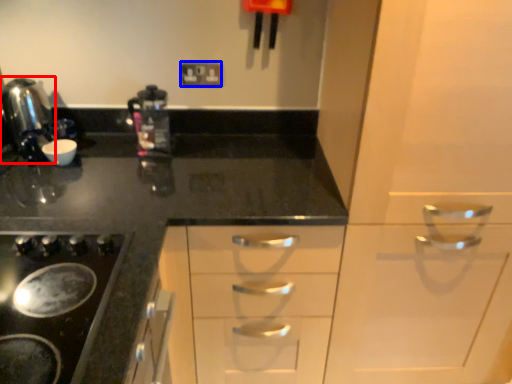
Question: Which object appears closest to the camera in this image, kitchen appliance (highlighted by a red box) or electric outlet (highlighted by a blue box)?

Choices:
 (A) kitchen appliance
 (B) electric outlet

Answer: (A)